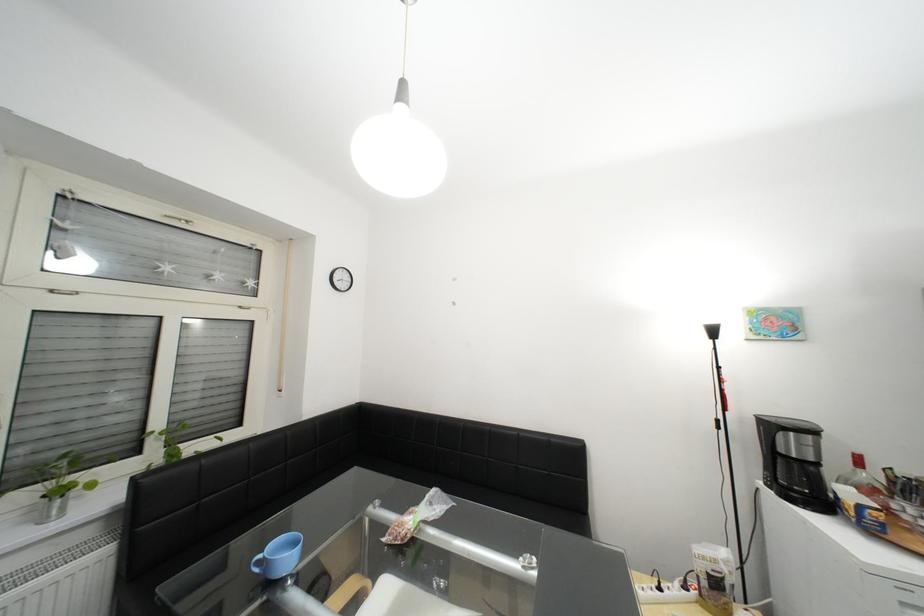
Where would you lift the plastic snack bag? Please return your answer as a coordinate pair (x, y).

(418, 516)